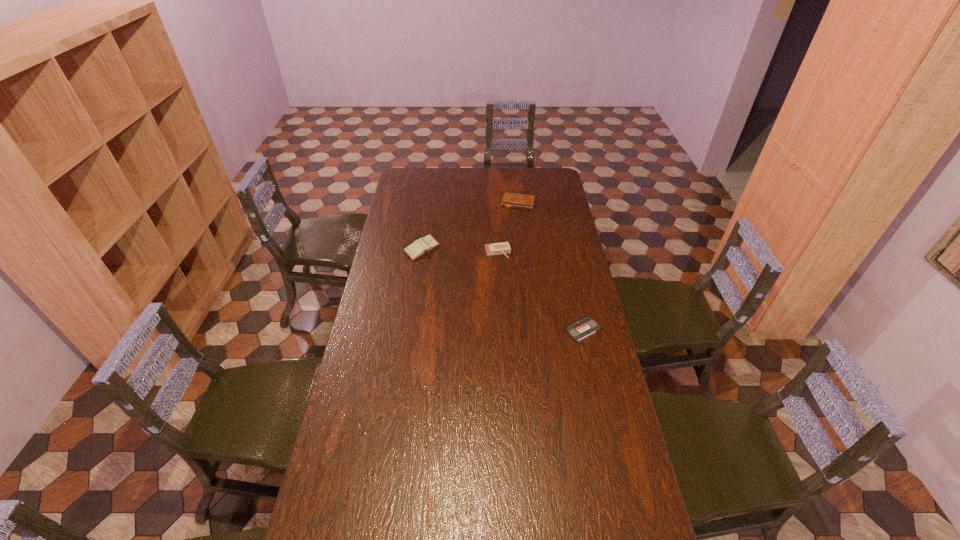
Find the location of a particular element. vacant space at the right edge is located at coordinates (644, 504).

The image size is (960, 540). What are the coordinates of `vacant area that lies between the farthest object and the rightmost object` in the screenshot? It's located at (550, 266).

Where is `free space that is in between the shortest object and the farther diary`? This screenshot has height=540, width=960. free space that is in between the shortest object and the farther diary is located at coordinates (550, 266).

Find the location of a particular element. Image resolution: width=960 pixels, height=540 pixels. vacant region between the nearest object and the leftmost object is located at coordinates (502, 290).

The image size is (960, 540). What are the coordinates of `empty space between the third tallest object and the second tallest object` in the screenshot? It's located at (508, 227).

You are a GUI agent. You are given a task and a screenshot of the screen. Output one action in this format:
    pyautogui.click(x=<x>, y=<y>)
    Task: Click on the free spot between the shortest object and the shorter diary
    This screenshot has width=960, height=540.
    Given the screenshot: What is the action you would take?
    pyautogui.click(x=550, y=266)

You are a GUI agent. You are given a task and a screenshot of the screen. Output one action in this format:
    pyautogui.click(x=<x>, y=<y>)
    Task: Click on the vacant area that lies between the matchbox and the left diary
    This screenshot has width=960, height=540.
    Given the screenshot: What is the action you would take?
    pyautogui.click(x=460, y=251)

Locate an element on the screen. This screenshot has width=960, height=540. unoccupied position between the second tallest object and the third tallest object is located at coordinates (508, 227).

This screenshot has width=960, height=540. Find the location of `vacant space that's between the shortest object and the nearer diary`. vacant space that's between the shortest object and the nearer diary is located at coordinates (502, 290).

Where is `vacant space that is in between the matchbox and the leftmost object`? vacant space that is in between the matchbox and the leftmost object is located at coordinates (460, 251).